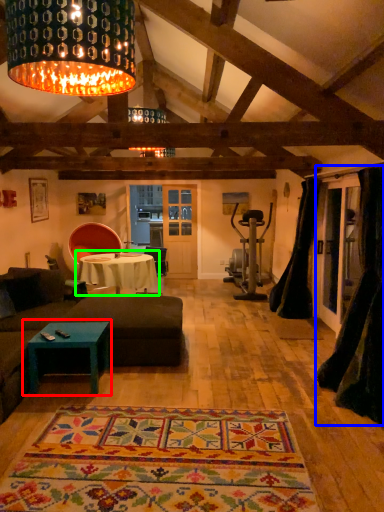
Question: Estimate the real-world distances between objects in this image. Which object is farther from coffee table (highlighted by a red box), curtain (highlighted by a blue box) or table (highlighted by a green box)?

Choices:
 (A) curtain
 (B) table

Answer: (B)